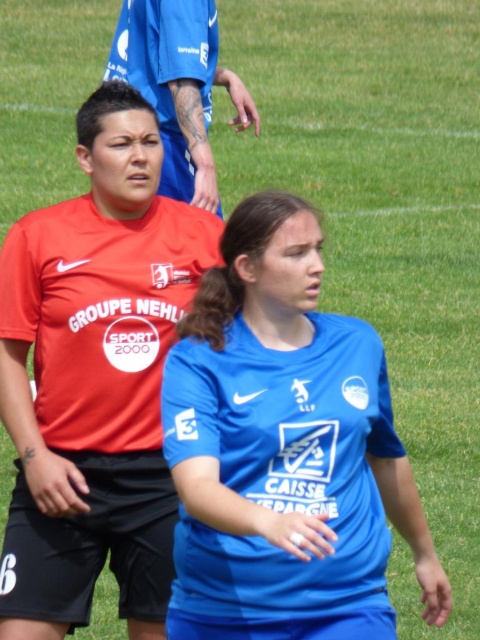
You are a photographer positioned at the camera. You want to capture a closeup shot of the blue jersey at center without moving the camera. Can you do it with a standard lens that has a maximum focal length of 50mm?

The blue jersey at center is 2.93 meters from camera. With a standard lens at 50mm, you can achieve a closeup by adjusting the aperture and shutter speed, as the distance allows the lens to focus clearly without needing to move closer.

You are a soccer coach observing the players on the field. You notice the blue jersey at center and the matte red shirt at left. Which player is blocking the view of the other?

The blue jersey at center is blocking the view of the matte red shirt at left because it is positioned in front of it.

You are a sports equipment manager trying to organize jerseys in a locker room. You have two blue jerseys in front of you. One is labeled as the blue jersey at center and the other as the matte blue jersey at upper center. Which one should you place on the top shelf if the shelf can only hold larger items?

The matte blue jersey at upper center should be placed on the top shelf because it is larger than the blue jersey at center, making it suitable for the shelf designated for larger items.